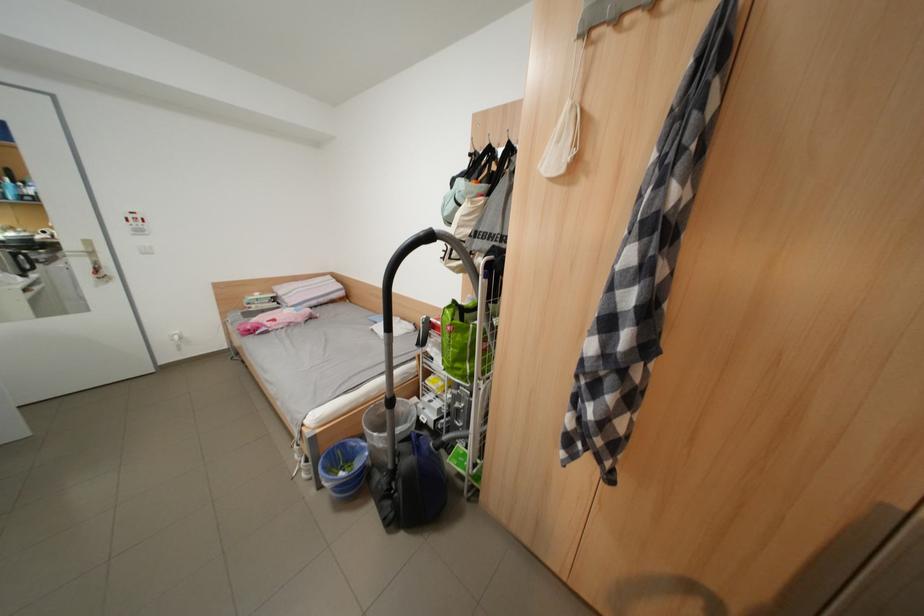
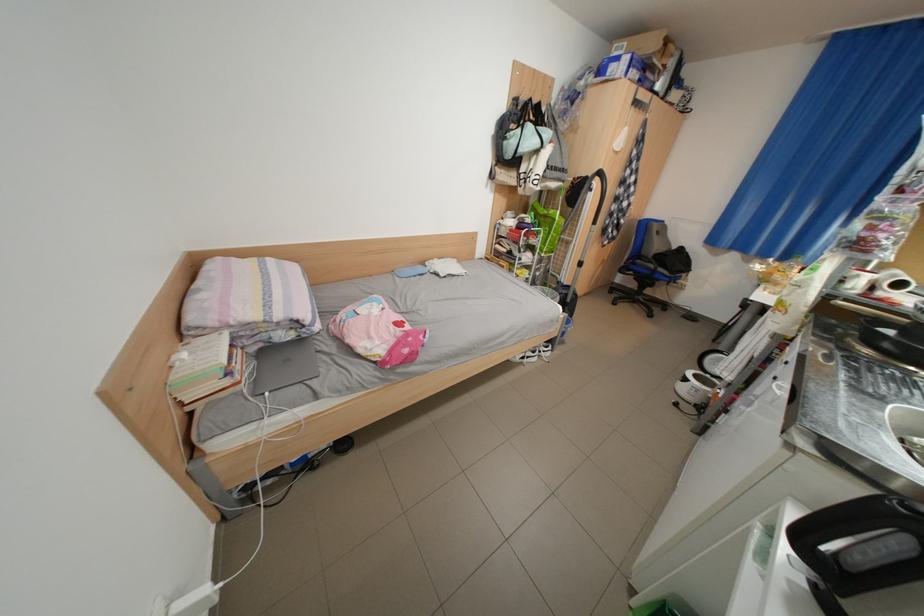
The point at (467,206) is marked in the first image. Where is the corresponding point in the second image?

(552, 147)